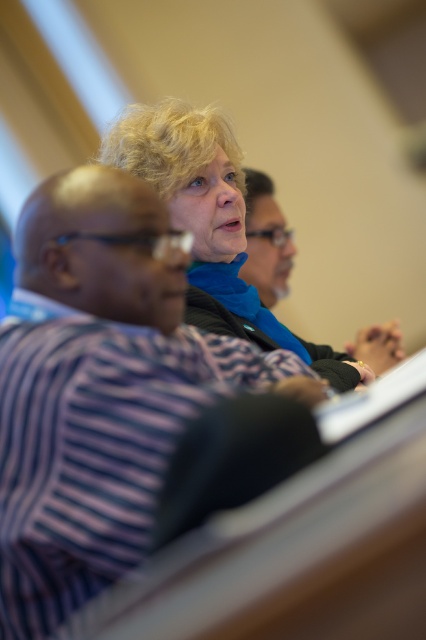
Based on the scene description, where is the purple striped shirt at upper center located in the image?

The purple striped shirt at upper center is located at the 2D coordinates point (121,400) in the image.

You are taking a photo of the scene and want to focus on the two points labeled as point (29, 385) and point (279, 216). Which point should you adjust your camera focus to ensure the closer one is sharp?

Point (29, 385) is closer to the camera than point (279, 216), so you should focus on point (29, 385) to ensure the closer one is sharp.